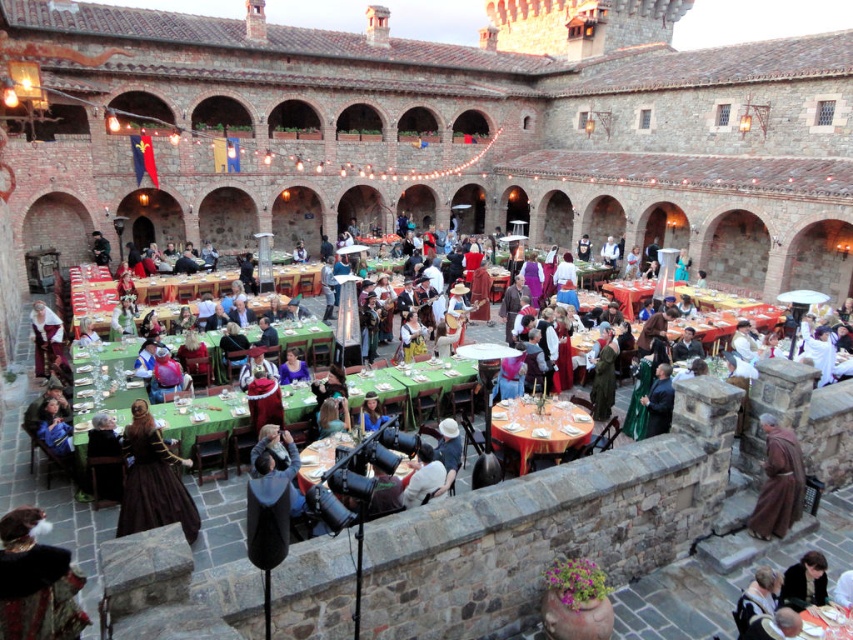
Question: Is green fabric table at center above brown leather jacket at lower center?

Choices:
 (A) yes
 (B) no

Answer: (A)

Question: Can you confirm if orange tablecloth at center is positioned to the left of matte brown robe at lower left?

Choices:
 (A) yes
 (B) no

Answer: (B)

Question: Which of the following is the closest to the observer?

Choices:
 (A) brown woolen robe at lower right
 (B) matte brown robe at lower left

Answer: (A)

Question: Among these objects, which one is nearest to the camera?

Choices:
 (A) green fabric table at center
 (B) smooth gray robe at lower right
 (C) light brown leather jacket at lower right
 (D) brown woolen robe at lower right

Answer: (B)

Question: Among these objects, which one is nearest to the camera?

Choices:
 (A) velvet brown dress at lower left
 (B) brown woolen robe at lower right

Answer: (A)

Question: Is velvet brown dress at lower left to the left of matte brown robe at lower left from the viewer's perspective?

Choices:
 (A) no
 (B) yes

Answer: (A)